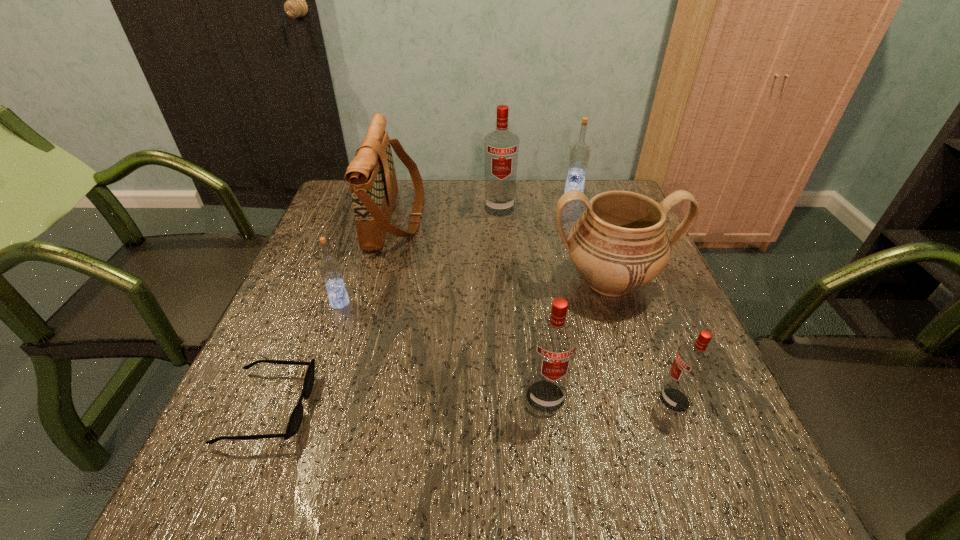
In order to click on blank space located on the front label of the rightmost vodka in this screenshot , I will do (x=544, y=400).

Locate an element on the screen. free region located on the back of the smaller blue vodka is located at coordinates (373, 204).

Image resolution: width=960 pixels, height=540 pixels. What are the coordinates of `vacant space located 0.400m on the front-facing side of the shortest object` in the screenshot? It's located at tap(528, 407).

Locate an element on the screen. The image size is (960, 540). shoulder bag that is positioned at the far edge is located at coordinates (371, 174).

The image size is (960, 540). Find the location of `shoulder bag at the left edge`. shoulder bag at the left edge is located at coordinates (371, 174).

You are a GUI agent. You are given a task and a screenshot of the screen. Output one action in this format:
    pyautogui.click(x=<x>, y=<y>)
    Task: Click on the vodka situated at the left edge
    
    Given the screenshot: What is the action you would take?
    pyautogui.click(x=330, y=268)

Image resolution: width=960 pixels, height=540 pixels. Identify the location of sunglasses positioned at the left edge. (295, 419).

At what (x,y) coordinates should I click in order to perform the action: click on urn present at the right edge. Please return your answer as a coordinate pair (x, y). The image size is (960, 540). Looking at the image, I should click on (619, 244).

This screenshot has height=540, width=960. What are the coordinates of `object at the far left corner` in the screenshot? It's located at (371, 174).

Find the location of a particular element. The image size is (960, 540). object that is at the far right corner is located at coordinates (579, 154).